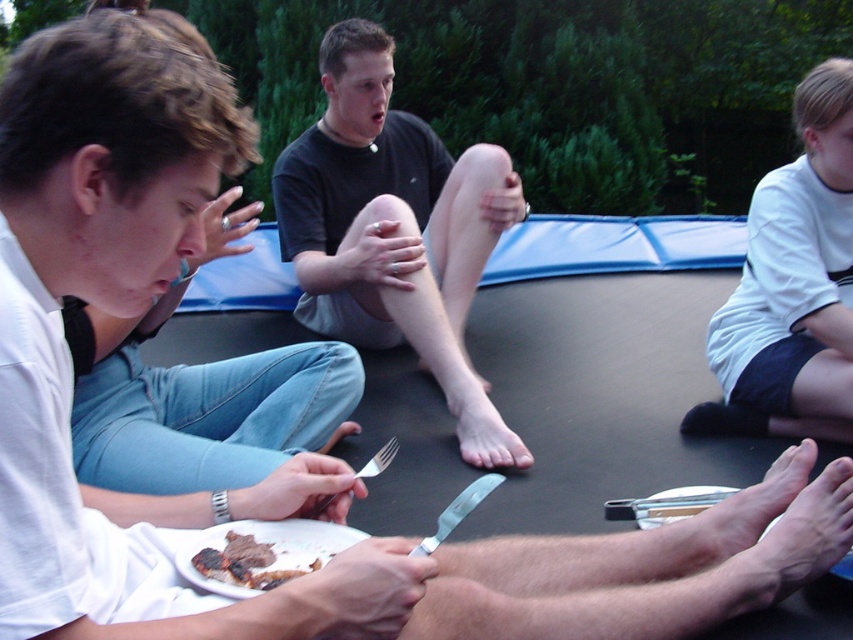
What are the coordinates of `charred wooden steak at lower center` in the screenshot? It's located at (254, 554).

Does charred wooden steak at lower center have a greater width compared to silver metallic fork at lower center?

Correct, the width of charred wooden steak at lower center exceeds that of silver metallic fork at lower center.

Does point (267, 547) come closer to viewer compared to point (389, 451)?

Yes.

Where is `charred wooden steak at lower center`? The height and width of the screenshot is (640, 853). charred wooden steak at lower center is located at coordinates (254, 554).

Is point (305, 164) behind point (793, 184)?

Yes, it is behind point (793, 184).

At what (x,y) coordinates should I click in order to perform the action: click on black matte shirt at center. Please return your answer as a coordinate pair (x, y). This screenshot has width=853, height=640. Looking at the image, I should click on (393, 230).

Can you confirm if black matte shirt at center is positioned below charred wooden steak at lower center?

Actually, black matte shirt at center is above charred wooden steak at lower center.

Is black matte shirt at center to the right of charred wooden steak at lower center from the viewer's perspective?

Indeed, black matte shirt at center is positioned on the right side of charred wooden steak at lower center.

Does point (340, 170) lie behind point (236, 552)?

Yes.

Locate an element on the screen. black matte shirt at center is located at coordinates (393, 230).